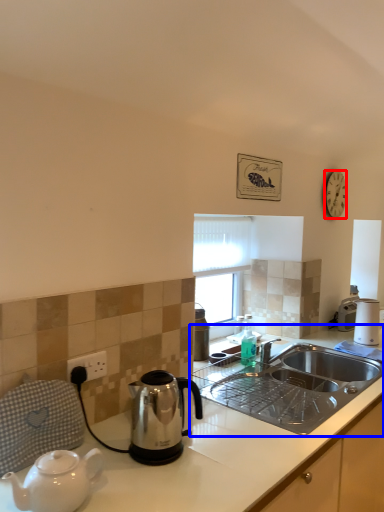
Question: Which object is closer to the camera taking this photo, clock (highlighted by a red box) or countertop (highlighted by a blue box)?

Choices:
 (A) clock
 (B) countertop

Answer: (B)